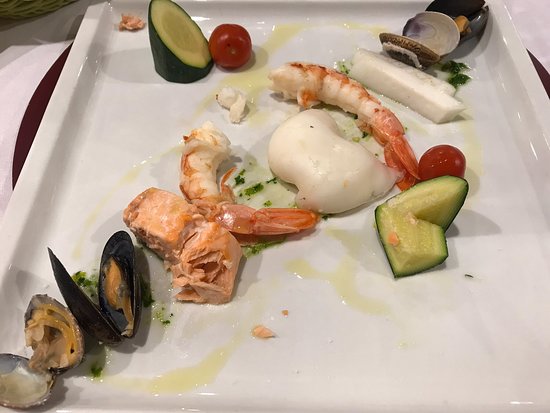
The width and height of the screenshot is (550, 413). In order to click on edge of plate in this screenshot , I will do `click(69, 70)`.